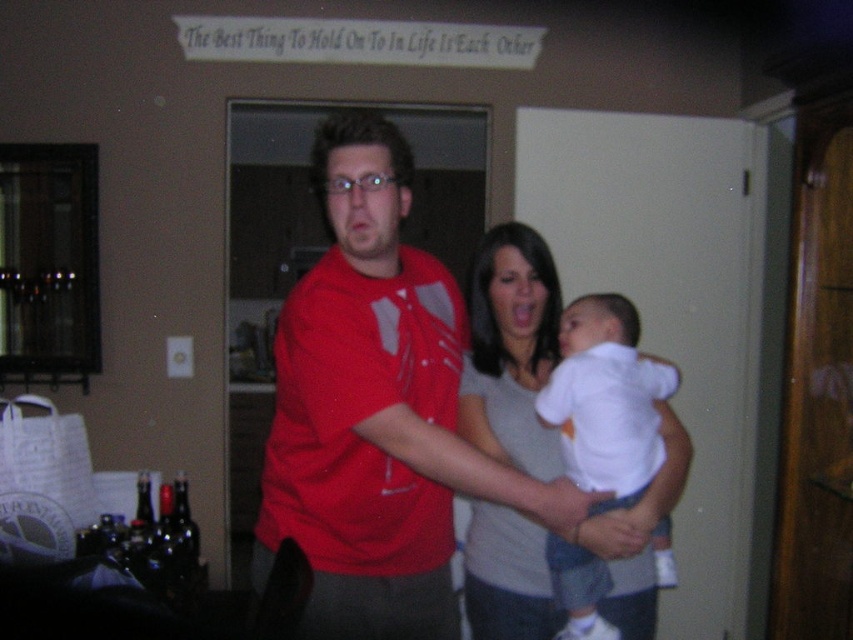
You are a photographer setting up a camera at eye level with the matte red shirt at center. You want to ensure the white soft fabric baby at center is fully visible in the photo. Is the baby visible without obstruction?

The matte red shirt at center is taller than the white soft fabric baby at center, so the baby may be partially or fully obstructed depending on their positions. Adjust the camera angle or position to ensure visibility.

You are a photographer trying to capture a candid shot of the matte red shirt at center and the white soft fabric baby at center. Since you want the baby to be the focus, should you adjust your camera to focus on a higher or lower point?

The matte red shirt at center is above the white soft fabric baby at center, so to focus on the baby, you should adjust your camera to focus on a lower point.

You are a photographer trying to capture a candid shot of the matte red shirt at center and the white soft fabric baby at center. Which object should you focus on first if you want to capture both in the same frame without moving the camera?

You should focus on the matte red shirt at center first because it is positioned on the left side of the white soft fabric baby at center, so focusing on the leftmost object will ensure both are in the frame.